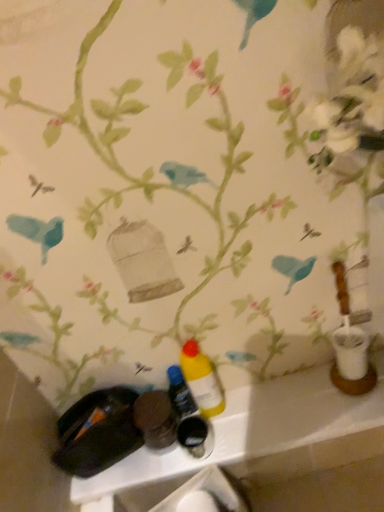
Question: From a real-world perspective, is yellow matte bottle at center, marked as the second bottle in a right-to-left arrangement, positioned over matte plastic bottles at lower center based on gravity?

Choices:
 (A) no
 (B) yes

Answer: (B)

Question: From a real-world perspective, is yellow matte bottle at center, marked as the second bottle in a right-to-left arrangement, positioned under matte plastic bottles at lower center based on gravity?

Choices:
 (A) no
 (B) yes

Answer: (A)

Question: From the image's perspective, is yellow matte bottle at center, marked as the second bottle in a right-to-left arrangement, on top of matte plastic bottles at lower center?

Choices:
 (A) yes
 (B) no

Answer: (A)

Question: Does yellow matte bottle at center, marked as the second bottle in a right-to-left arrangement, have a greater height compared to matte plastic bottles at lower center?

Choices:
 (A) no
 (B) yes

Answer: (B)

Question: Is yellow matte bottle at center, marked as the second bottle in a right-to-left arrangement, in contact with matte plastic bottles at lower center?

Choices:
 (A) yes
 (B) no

Answer: (B)

Question: Considering the relative positions of yellow matte bottle at center, which is counted as the 1th bottle, starting from the left, and matte plastic bottles at lower center in the image provided, is yellow matte bottle at center, which is counted as the 1th bottle, starting from the left, to the left or to the right of matte plastic bottles at lower center?

Choices:
 (A) left
 (B) right

Answer: (A)

Question: In terms of width, does yellow matte bottle at center, marked as the second bottle in a right-to-left arrangement, look wider or thinner when compared to matte plastic bottles at lower center?

Choices:
 (A) wide
 (B) thin

Answer: (B)

Question: Is yellow matte bottle at center, marked as the second bottle in a right-to-left arrangement, in front of or behind matte plastic bottles at lower center in the image?

Choices:
 (A) front
 (B) behind

Answer: (B)

Question: Would you say yellow matte bottle at center, which is counted as the 1th bottle, starting from the left, is inside or outside matte plastic bottles at lower center?

Choices:
 (A) outside
 (B) inside

Answer: (A)

Question: From a real-world perspective, relative to matte plastic bottles at lower center, is yellow matte bottle at center, which ranks as the 1th bottle in right-to-left order, vertically above or below?

Choices:
 (A) above
 (B) below

Answer: (A)

Question: Considering the positions of yellow matte bottle at center, which ranks as the 1th bottle in right-to-left order, and matte plastic bottles at lower center in the image, is yellow matte bottle at center, which ranks as the 1th bottle in right-to-left order, bigger or smaller than matte plastic bottles at lower center?

Choices:
 (A) big
 (B) small

Answer: (B)

Question: Considering the positions of yellow matte bottle at center, which is counted as the 2th bottle, starting from the left, and matte plastic bottles at lower center in the image, is yellow matte bottle at center, which is counted as the 2th bottle, starting from the left, taller or shorter than matte plastic bottles at lower center?

Choices:
 (A) short
 (B) tall

Answer: (B)

Question: Looking at their shapes, would you say yellow matte bottle at center, which ranks as the 1th bottle in right-to-left order, is wider or thinner than matte plastic bottles at lower center?

Choices:
 (A) wide
 (B) thin

Answer: (B)

Question: Is yellow matte bottle at center, which is counted as the 2th bottle, starting from the left, wider or thinner than yellow matte bottle at center, marked as the second bottle in a right-to-left arrangement?

Choices:
 (A) wide
 (B) thin

Answer: (A)

Question: Do you think yellow matte bottle at center, which is counted as the 2th bottle, starting from the left, is within yellow matte bottle at center, marked as the second bottle in a right-to-left arrangement, or outside of it?

Choices:
 (A) outside
 (B) inside

Answer: (A)